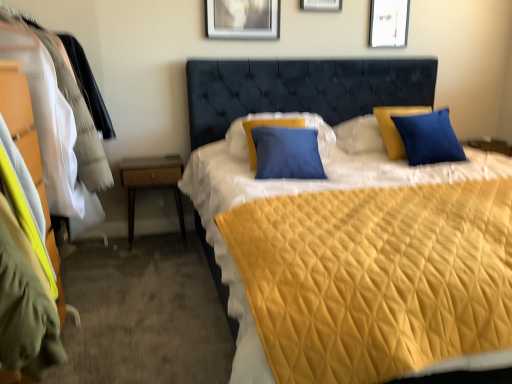
Locate an element on the screen. free space in front of wooden nightstand at lower left is located at coordinates (147, 254).